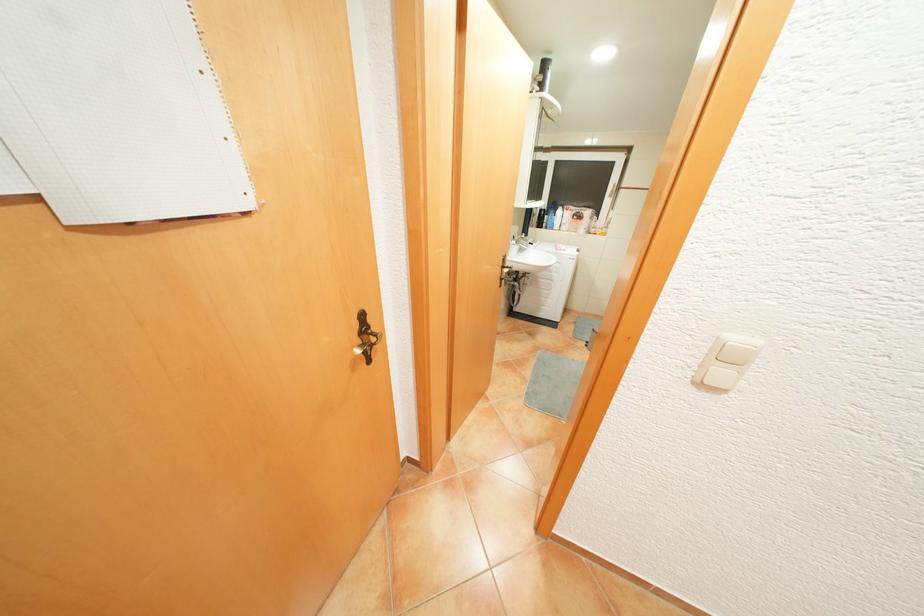
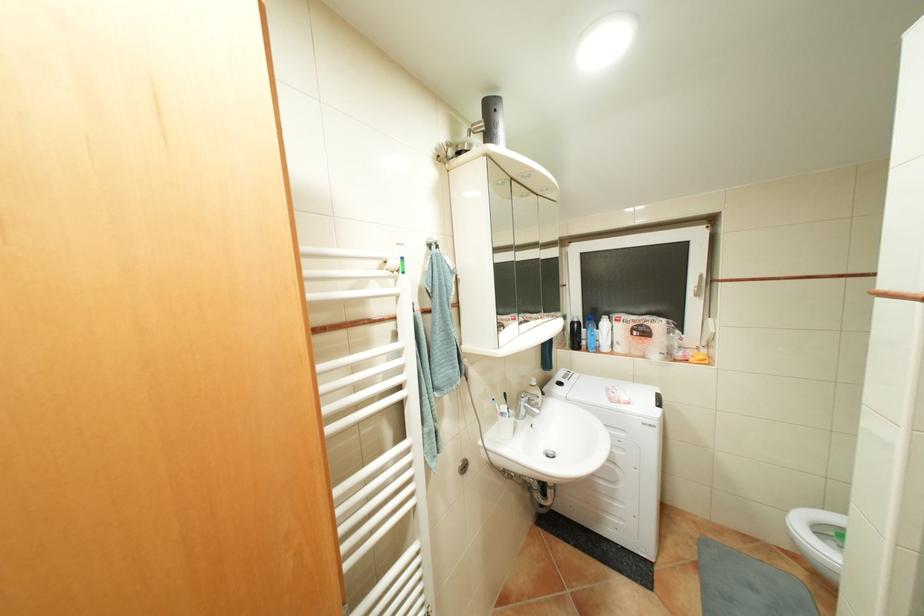
Find the pixel in the second image that matches [562,228] in the first image.

(608, 350)